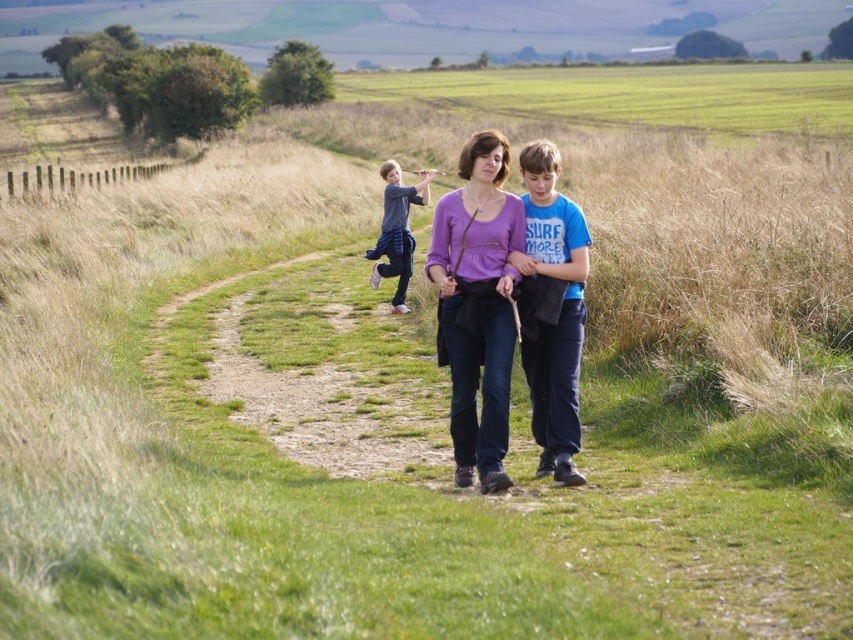
Question: Is purple matte shirt at center further to the viewer compared to blue cotton shirt at center?

Choices:
 (A) no
 (B) yes

Answer: (A)

Question: Is purple matte shirt at center above blue cotton shirt at center?

Choices:
 (A) yes
 (B) no

Answer: (B)

Question: From the image, what is the correct spatial relationship of purple matte shirt at center in relation to dark gray cotton shirt at center?

Choices:
 (A) right
 (B) left

Answer: (A)

Question: Among these points, which one is farthest from the camera?

Choices:
 (A) (525, 228)
 (B) (387, 189)
 (C) (498, 292)

Answer: (B)

Question: Which point is closer to the camera?

Choices:
 (A) dark gray cotton shirt at center
 (B) blue cotton shirt at center

Answer: (B)

Question: Which is farther from the blue cotton shirt at center?

Choices:
 (A) dark gray cotton shirt at center
 (B) purple matte shirt at center

Answer: (A)